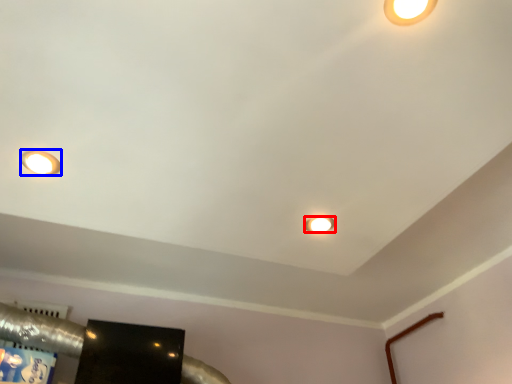
Question: Which object is closer to the camera taking this photo, lamp (highlighted by a red box) or lamp (highlighted by a blue box)?

Choices:
 (A) lamp
 (B) lamp

Answer: (B)